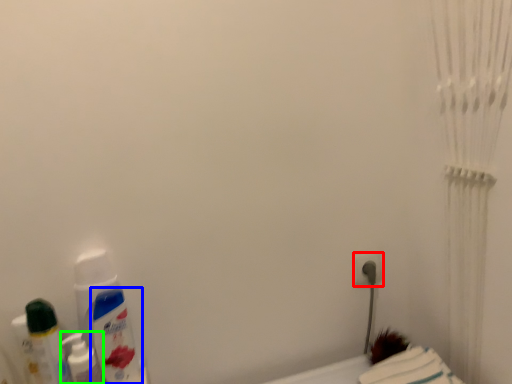
Question: Based on their relative distances, which object is farther from power plugs and sockets (highlighted by a red box)? Choose from mouthwash (highlighted by a blue box) and mouthwash (highlighted by a green box).

Choices:
 (A) mouthwash
 (B) mouthwash

Answer: (B)